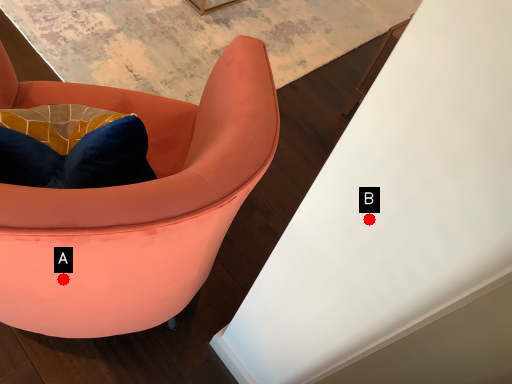
Question: Two points are circled on the image, labeled by A and B beside each circle. Which point appears closest to the camera in this image?

Choices:
 (A) A is closer
 (B) B is closer

Answer: (B)